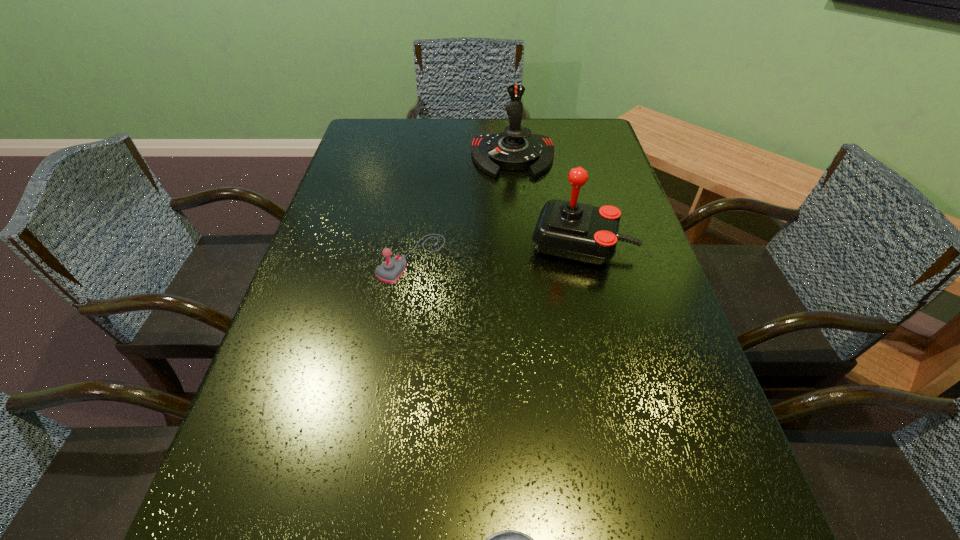
Identify the location of free point at the right edge. (720, 531).

Locate an element on the screen. This screenshot has width=960, height=540. free region at the far left corner of the desktop is located at coordinates (396, 157).

Find the location of a particular element. The image size is (960, 540). vacant position at the far right corner of the desktop is located at coordinates (555, 127).

Locate which object is the closest to the ashtray. Please provide its 2D coordinates. Your answer should be formatted as a tuple, i.e. [(x, y)], where the tuple contains the x and y coordinates of a point satisfying the conditions above.

[(391, 270)]

Where is `object that is the third closest to the nearest object`? object that is the third closest to the nearest object is located at coordinates (516, 148).

Identify the location of joystick that is the second closest to the farthest object. The width and height of the screenshot is (960, 540). (391, 270).

The image size is (960, 540). Find the location of `joystick identified as the closest to the farthest object`. joystick identified as the closest to the farthest object is located at coordinates (581, 232).